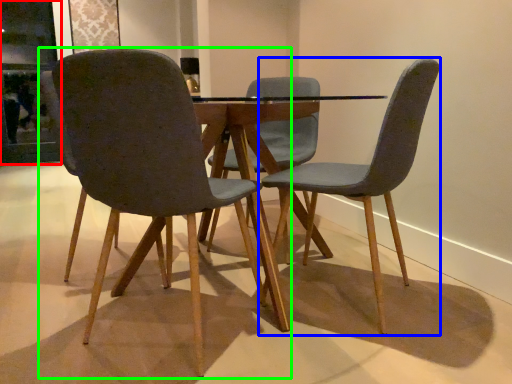
Question: Which is nearer to the glass door (highlighted by a red box)? chair (highlighted by a blue box) or chair (highlighted by a green box).

Choices:
 (A) chair
 (B) chair

Answer: (B)